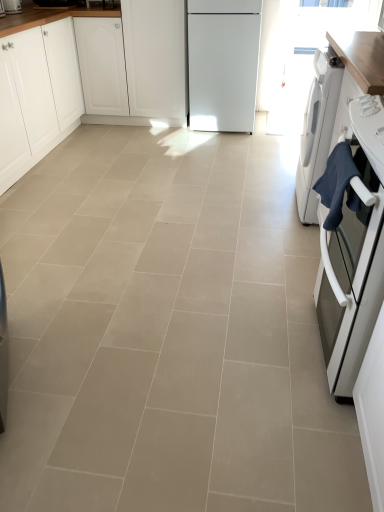
Locate an element on the screen. This screenshot has width=384, height=512. vacant space in front of white matte cabinet at center, the first cabinetry in the right-to-left sequence is located at coordinates (158, 137).